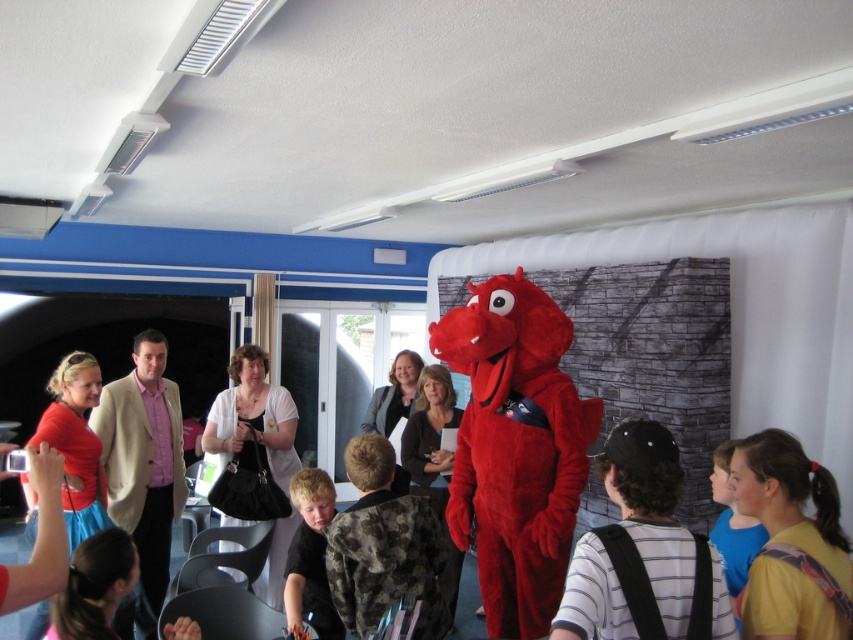
You are standing in the room and want to take a photo of both point (664,548) and point (224,433). Which point should you focus on first to ensure both are in focus?

You should focus on point (664,548) first because it is closer to the camera than point (224,433), ensuring both points are within the depth of field.

You are standing in the room and want to take a photo of both point (671,580) and point (740,483). Which point should you focus on first to ensure both are in focus?

You should focus on point (671,580) first because it is closer to the camera than point (740,483), ensuring the depth of field captures both points.

You are organizing a photo shoot and need to position two models wearing the striped cotton shirt at center and the black fabric dress at center. Based on the scene description, which model should stand higher to maintain the original spatial relationship?

→ The striped cotton shirt at center should be positioned higher than the black fabric dress at center to maintain the original spatial relationship.